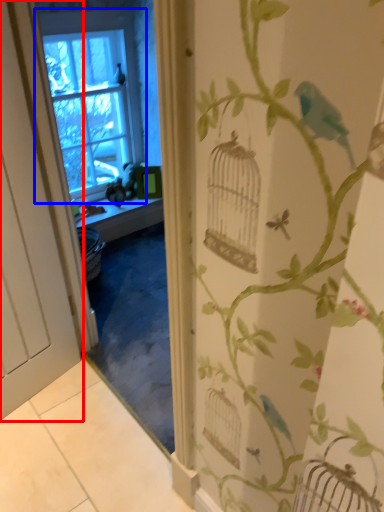
Question: Among these objects, which one is farthest to the camera, door (highlighted by a red box) or window (highlighted by a blue box)?

Choices:
 (A) door
 (B) window

Answer: (B)